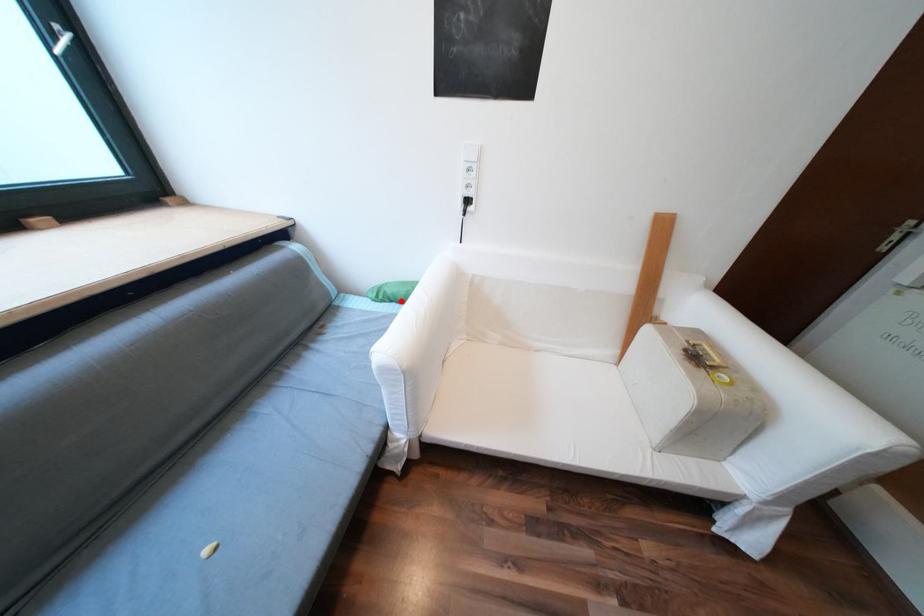
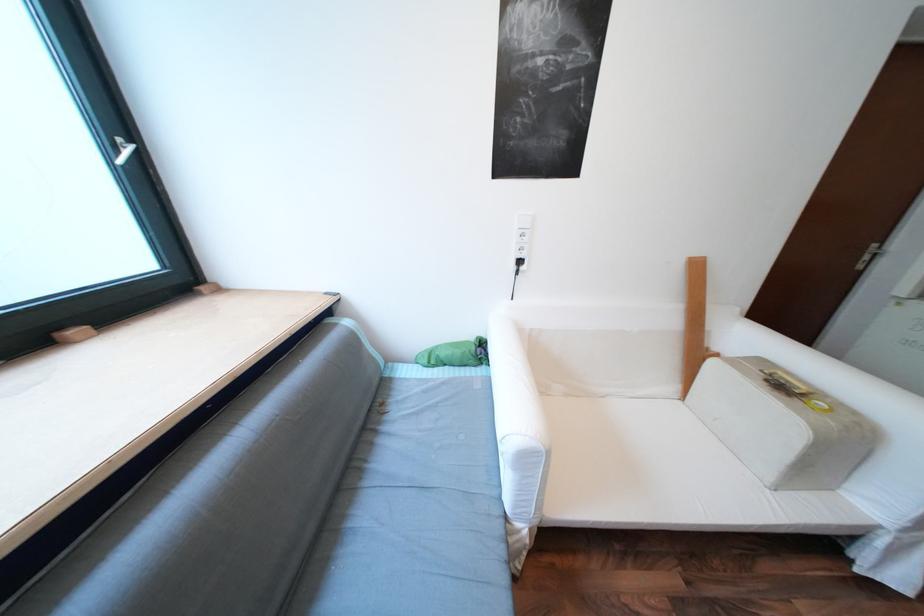
Question: I am providing you with two images of the same scene from different viewpoints. A red point is shown in image1. For the corresponding object point in image2, is it positioned nearer or farther from the camera?

Choices:
 (A) Nearer
 (B) Farther

Answer: (B)